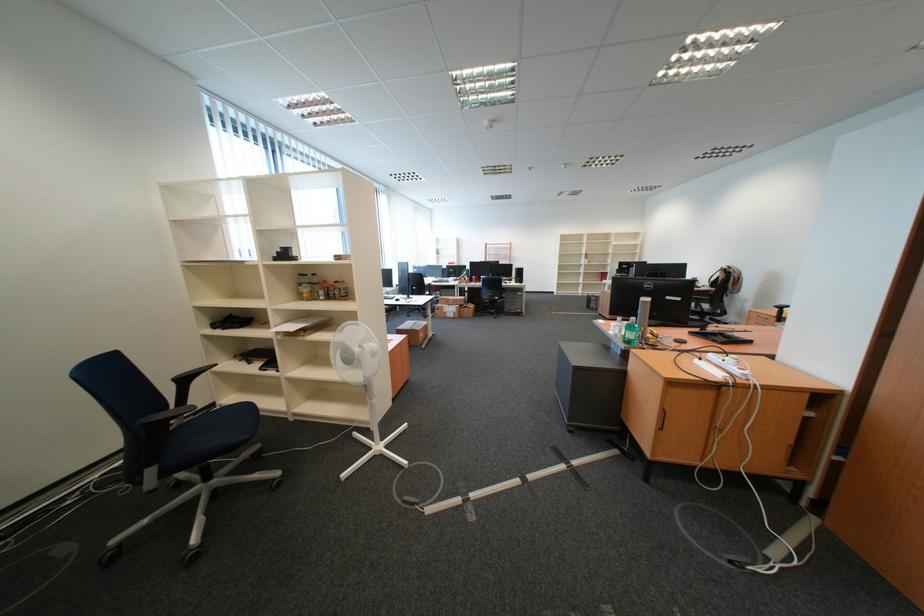
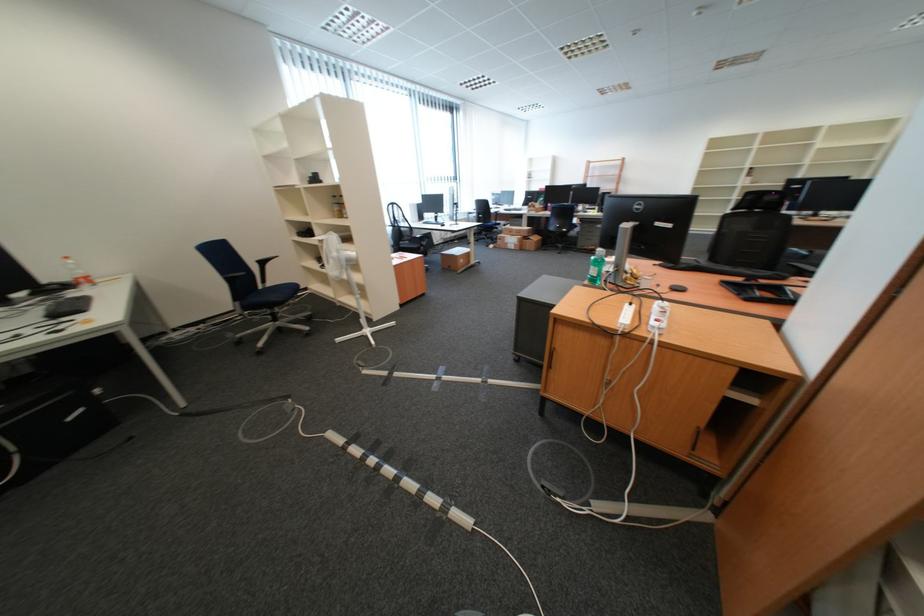
The point at [468,302] is marked in the first image. Where is the corresponding point in the second image?

(531, 233)